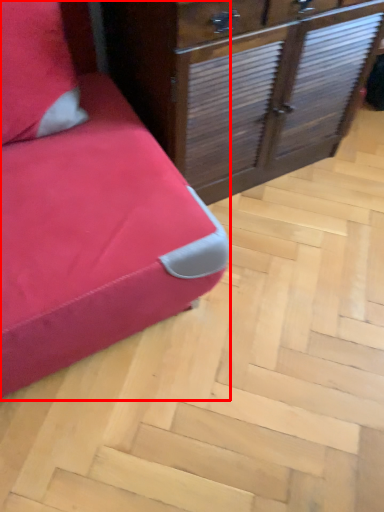
Question: From the image's perspective, where is furniture (annotated by the red box) located in relation to chest of drawers in the image?

Choices:
 (A) above
 (B) below

Answer: (B)